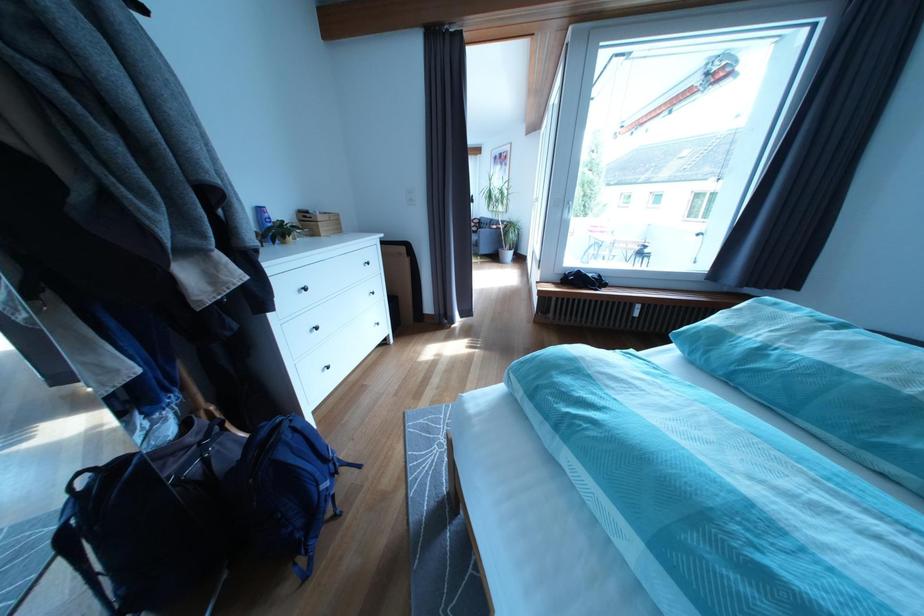
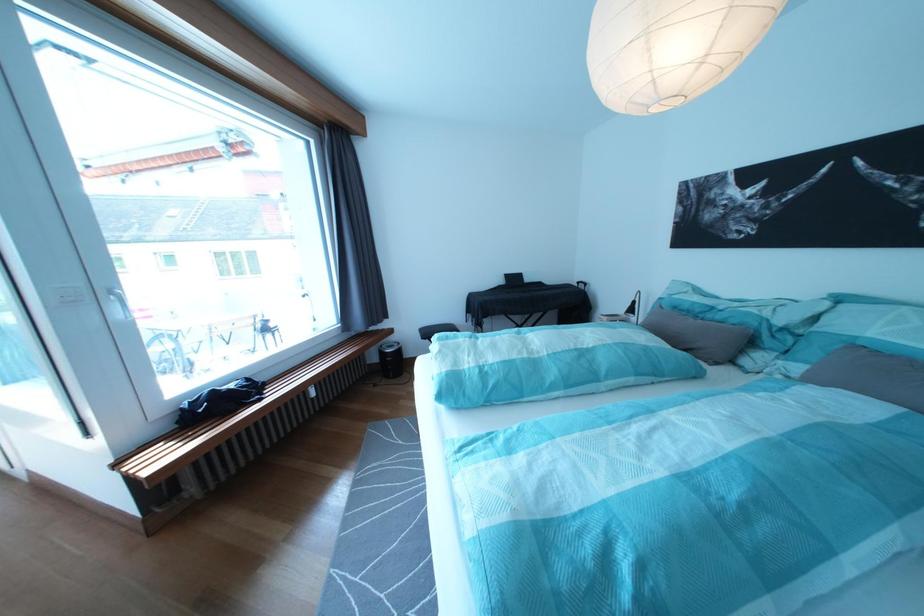
Locate, in the second image, the point that corresponds to point (579, 221) in the first image.

(130, 321)